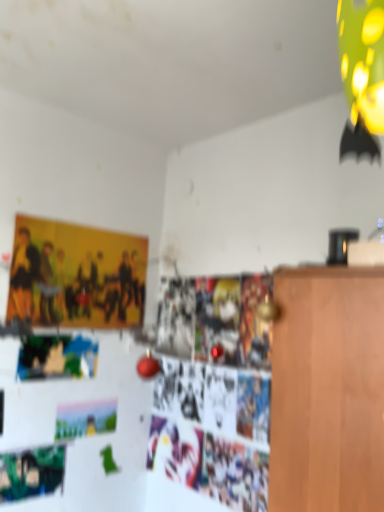
Question: Is green matte poster at lower left inside or outside of pastel matte postcard at lower left?

Choices:
 (A) outside
 (B) inside

Answer: (A)

Question: In terms of width, does green matte poster at lower left look wider or thinner when compared to pastel matte postcard at lower left?

Choices:
 (A) thin
 (B) wide

Answer: (A)

Question: Which is farther from the matte yellow poster at upper left?

Choices:
 (A) green matte poster at lower left
 (B) pastel matte postcard at lower left

Answer: (A)

Question: Which is farther from the pastel matte postcard at lower left?

Choices:
 (A) green matte poster at lower left
 (B) matte yellow poster at upper left

Answer: (B)